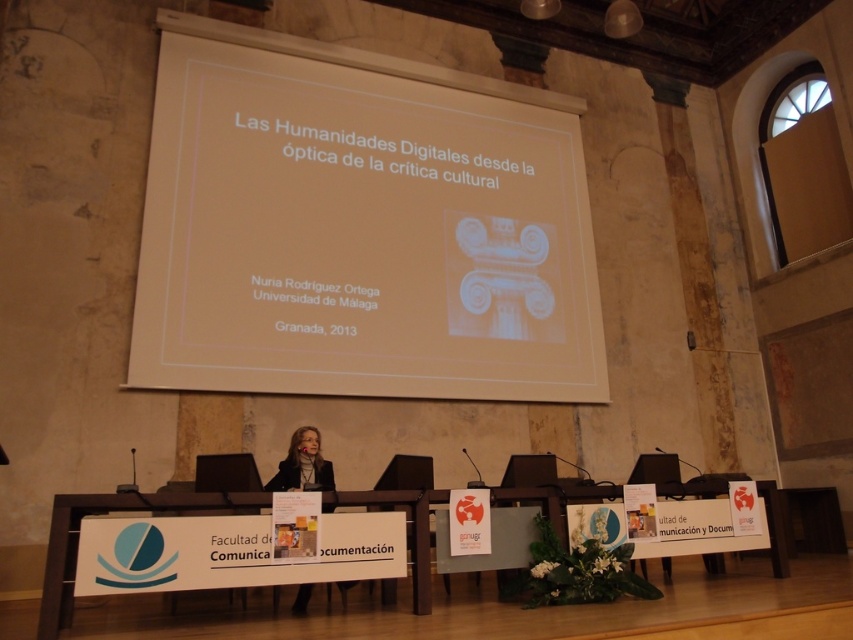
Question: Can you confirm if white wood table at center is bigger than matte black suit at center?

Choices:
 (A) yes
 (B) no

Answer: (A)

Question: Is white paper at upper center in front of white wood table at center?

Choices:
 (A) yes
 (B) no

Answer: (B)

Question: Which object is closer to the camera taking this photo?

Choices:
 (A) matte black suit at center
 (B) white paper at upper center
 (C) white wood table at center

Answer: (C)

Question: Which point is closer to the camera taking this photo?

Choices:
 (A) (305, 609)
 (B) (404, 134)
 (C) (354, 500)

Answer: (C)

Question: Does white paper at upper center lie behind matte black suit at center?

Choices:
 (A) no
 (B) yes

Answer: (B)

Question: Which object is farther from the camera taking this photo?

Choices:
 (A) matte black suit at center
 (B) white paper at upper center

Answer: (B)